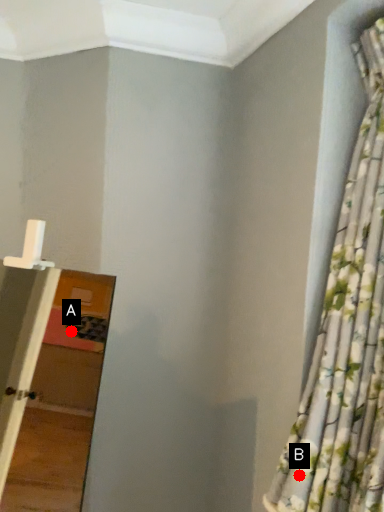
Question: Two points are circled on the image, labeled by A and B beside each circle. Which point is farther to the camera?

Choices:
 (A) A is further
 (B) B is further

Answer: (A)